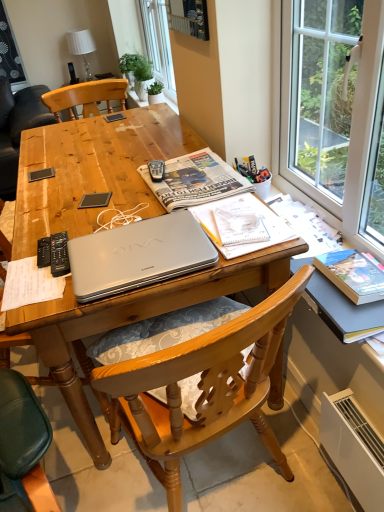
Question: From a real-world perspective, is black plastic remote control at left, which is counted as the first remote control, starting from the right, above or below silver metallic laptop at center?

Choices:
 (A) below
 (B) above

Answer: (B)

Question: From the image's perspective, relative to silver metallic laptop at center, is black plastic remote control at left, positioned as the 2th remote control in left-to-right order, above or below?

Choices:
 (A) above
 (B) below

Answer: (B)

Question: Which object is positioned farthest from the white fabric lampshade at upper center?

Choices:
 (A) silver metallic laptop at center
 (B) black plastic remote control at left, which is counted as the first remote control, starting from the right
 (C) black plastic remote control at left, which is counted as the first remote control, starting from the left
 (D) wooden table at center
 (E) silver metallic laptop at center

Answer: (A)

Question: Which object is the farthest from the white fabric lampshade at upper center?

Choices:
 (A) silver metallic laptop at center
 (B) silver metallic laptop at center
 (C) wooden table at center
 (D) black plastic remote control at left, which is counted as the second remote control, starting from the right
 (E) black plastic remote control at left, which is counted as the first remote control, starting from the right

Answer: (A)